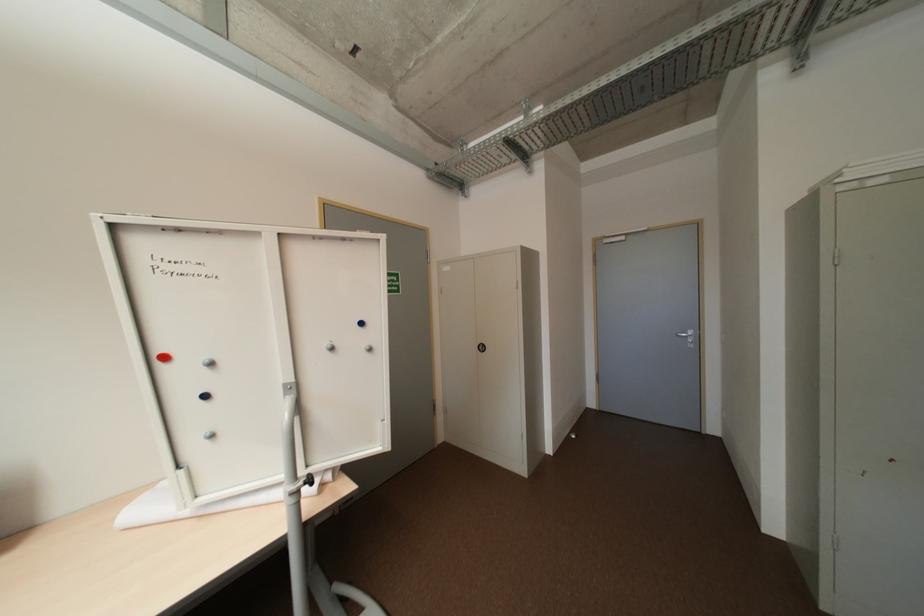
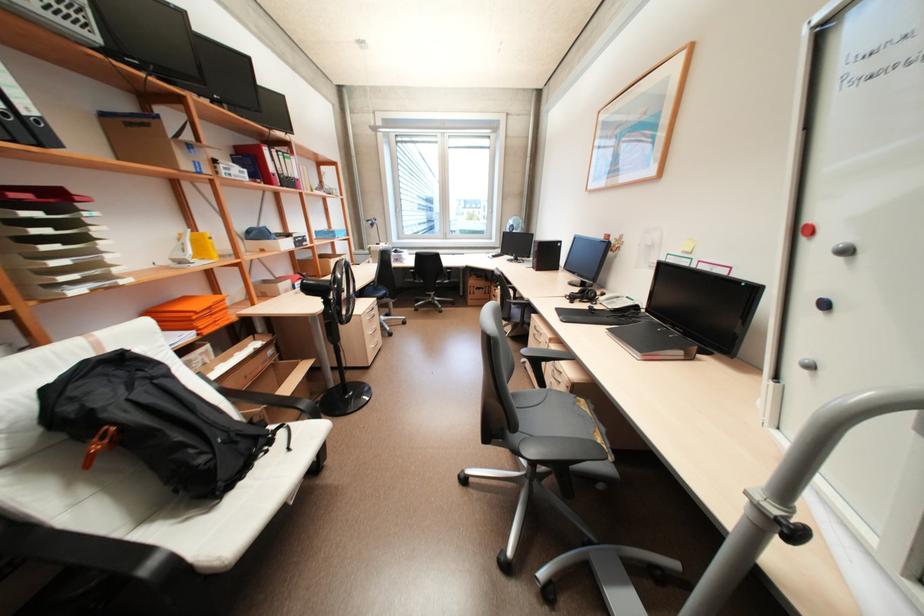
Find the pixel in the second image that matches (212,395) in the first image.

(830, 304)